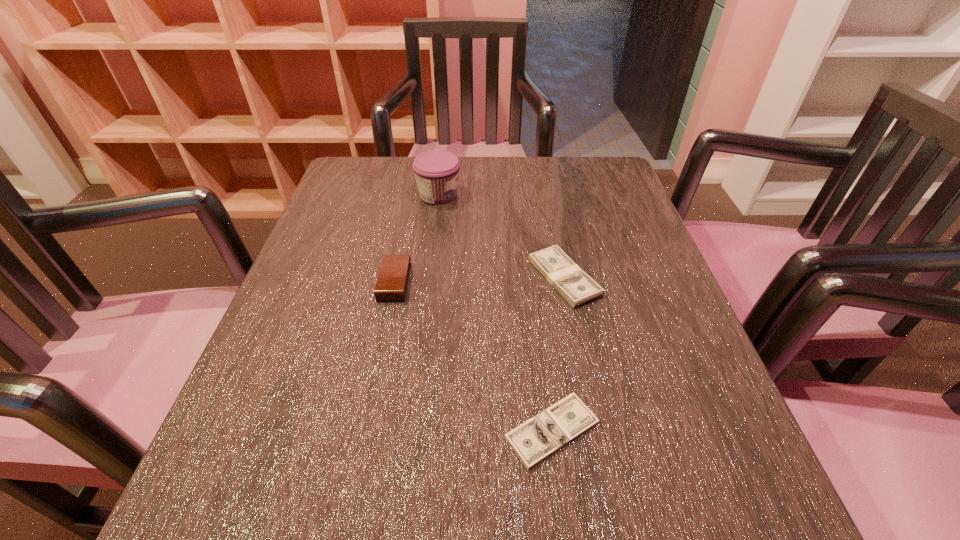
Locate an element on the screen. vacant area that lies between the second shortest object and the nearest object is located at coordinates (558, 354).

Find the location of a particular element. free area in between the nearest object and the farthest object is located at coordinates (495, 313).

Identify the location of vacant area that lies between the jam and the third shortest object. The image size is (960, 540). (417, 239).

This screenshot has width=960, height=540. What are the coordinates of `vacant area that lies between the nearer dollar and the farther dollar` in the screenshot? It's located at (558, 354).

I want to click on empty location between the farther dollar and the third shortest object, so click(479, 280).

Where is `free space that is in between the second tallest object and the nearer dollar`? free space that is in between the second tallest object and the nearer dollar is located at coordinates (473, 356).

You are a GUI agent. You are given a task and a screenshot of the screen. Output one action in this format:
    pyautogui.click(x=<x>, y=<y>)
    Task: Click on the vacant area that lies between the taller dollar and the shortest object
    This screenshot has width=960, height=540.
    Given the screenshot: What is the action you would take?
    pyautogui.click(x=558, y=354)

The image size is (960, 540). What are the coordinates of `free space between the tallest object and the alarm clock` in the screenshot? It's located at (417, 239).

Locate an element on the screen. vacant region between the farthest object and the third tallest object is located at coordinates (501, 236).

You are a GUI agent. You are given a task and a screenshot of the screen. Output one action in this format:
    pyautogui.click(x=<x>, y=<y>)
    Task: Click on the vacant area between the jam and the nearer dollar
    Image resolution: width=960 pixels, height=540 pixels.
    Given the screenshot: What is the action you would take?
    pyautogui.click(x=495, y=313)